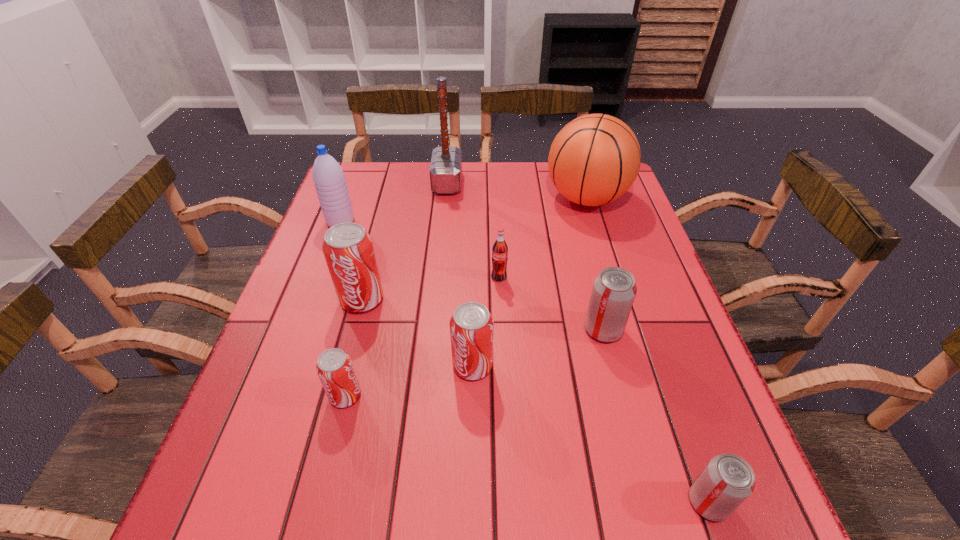
Locate an element on the screen. The width and height of the screenshot is (960, 540). free space between the basketball and the fourth soda can from right to left is located at coordinates (529, 282).

This screenshot has height=540, width=960. What are the coordinates of `empty space that is in between the bigger gray soda can and the nearest soda can` in the screenshot? It's located at (656, 416).

You are a GUI agent. You are given a task and a screenshot of the screen. Output one action in this format:
    pyautogui.click(x=<x>, y=<y>)
    Task: Click on the vacant region between the fourth soda can from right to left and the basketball
    The image size is (960, 540).
    Given the screenshot: What is the action you would take?
    pyautogui.click(x=529, y=282)

You are a GUI agent. You are given a task and a screenshot of the screen. Output one action in this format:
    pyautogui.click(x=<x>, y=<y>)
    Task: Click on the free space that is in between the farthest red soda can and the smaller gray soda can
    The image size is (960, 540).
    Given the screenshot: What is the action you would take?
    pyautogui.click(x=535, y=401)

Locate an element on the screen. The width and height of the screenshot is (960, 540). the fifth closest object to the rightmost soda can is located at coordinates (348, 249).

Find the location of a particular element. This screenshot has height=540, width=960. the second closest object to the hammer is located at coordinates pyautogui.click(x=594, y=159).

Identify which soda can is the nearest to the farthest soda can. Please provide its 2D coordinates. Your answer should be formatted as a tuple, i.e. [(x, y)], where the tuple contains the x and y coordinates of a point satisfying the conditions above.

[(614, 289)]

Where is `soda can that stands as the third closest to the fourth soda can from left to right`? This screenshot has width=960, height=540. soda can that stands as the third closest to the fourth soda can from left to right is located at coordinates (348, 249).

Identify which red soda can is the second closest to the basketball. Please provide its 2D coordinates. Your answer should be formatted as a tuple, i.e. [(x, y)], where the tuple contains the x and y coordinates of a point satisfying the conditions above.

[(348, 249)]

Identify which red soda can is located as the second nearest to the smallest red soda can. Please provide its 2D coordinates. Your answer should be formatted as a tuple, i.e. [(x, y)], where the tuple contains the x and y coordinates of a point satisfying the conditions above.

[(471, 326)]